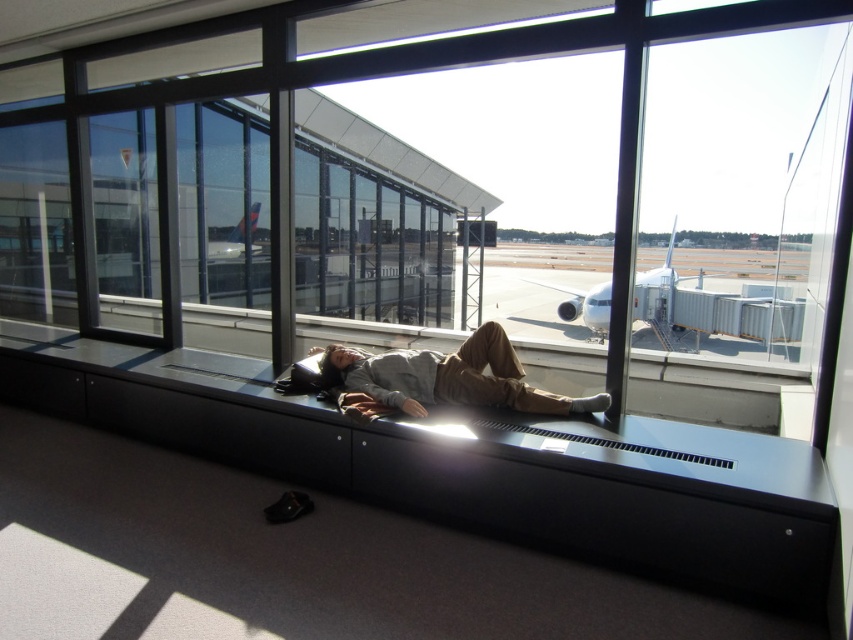
Question: Which of these objects is positioned farthest from the white matte airplane at center?

Choices:
 (A) light brown cotton pants at center
 (B) white glossy airplane at center

Answer: (A)

Question: In this image, where is light brown cotton pants at center located relative to white matte airplane at center?

Choices:
 (A) left
 (B) right

Answer: (A)

Question: Observing the image, what is the correct spatial positioning of light brown cotton pants at center in reference to white matte airplane at center?

Choices:
 (A) below
 (B) above

Answer: (A)

Question: Estimate the real-world distances between objects in this image. Which object is closer to the light brown cotton pants at center?

Choices:
 (A) white glossy airplane at center
 (B) white matte airplane at center

Answer: (A)

Question: Can you confirm if white matte airplane at center is wider than white glossy airplane at center?

Choices:
 (A) yes
 (B) no

Answer: (A)

Question: Which of the following is the closest to the observer?

Choices:
 (A) (260, 208)
 (B) (352, 368)
 (C) (573, 317)

Answer: (B)